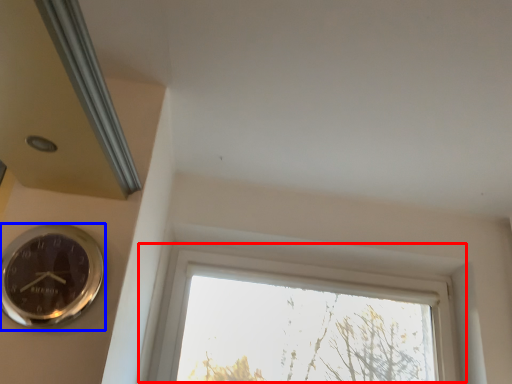
Question: Which object is closer to the camera taking this photo, window (highlighted by a red box) or wall clock (highlighted by a blue box)?

Choices:
 (A) window
 (B) wall clock

Answer: (B)